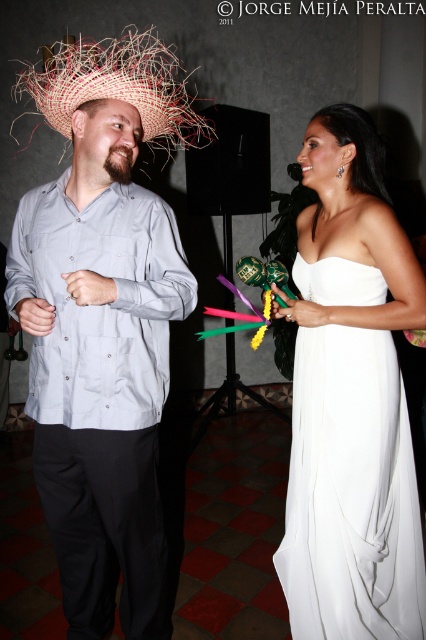
Is white satin dress at right positioned behind straw hat at upper left?

That is True.

Is white satin dress at right closer to the viewer compared to straw hat at upper left?

No, it is not.

Where is `white satin dress at right`? white satin dress at right is located at coordinates (351, 492).

Is matte straw hat at left to the left of straw hat at upper left from the viewer's perspective?

In fact, matte straw hat at left is to the right of straw hat at upper left.

How distant is matte straw hat at left from straw hat at upper left?

The distance of matte straw hat at left from straw hat at upper left is 30.11 inches.

Locate an element on the screen. matte straw hat at left is located at coordinates (103, 323).

At what (x,y) coordinates should I click in order to perform the action: click on matte straw hat at left. Please return your answer as a coordinate pair (x, y). Looking at the image, I should click on (103, 323).

Between matte straw hat at left and white satin dress at right, which one is positioned higher?

Positioned higher is matte straw hat at left.

Who is more distant from viewer, (115, 314) or (334, 284)?

The point (334, 284) is more distant.

Is point (114, 410) farther from viewer compared to point (319, 262)?

No, (114, 410) is in front of (319, 262).

Identify the location of matte straw hat at left. This screenshot has height=640, width=426. (103, 323).